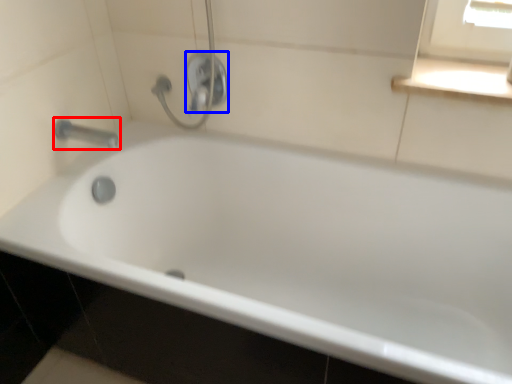
Question: Which object is further to the camera taking this photo, tap (highlighted by a red box) or shower (highlighted by a blue box)?

Choices:
 (A) tap
 (B) shower

Answer: (B)